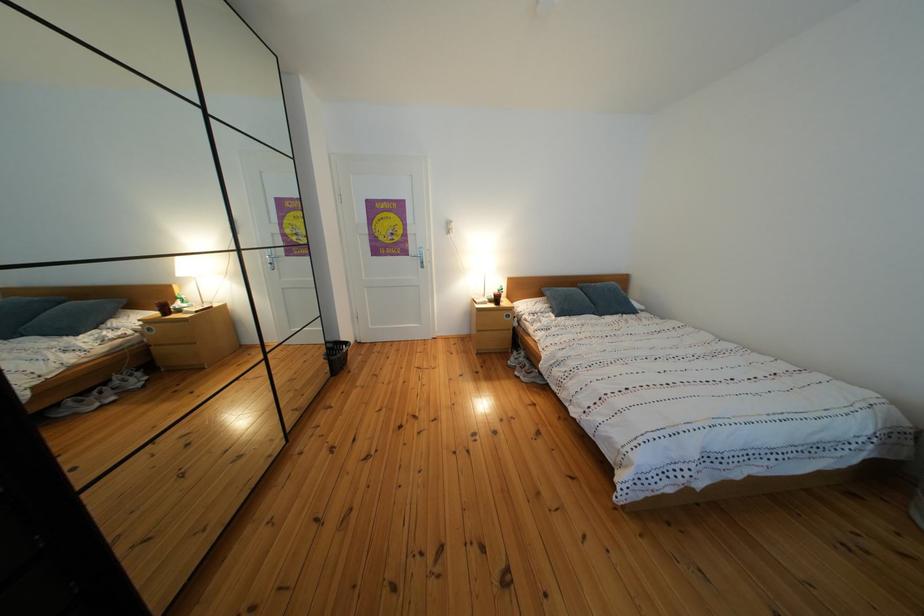
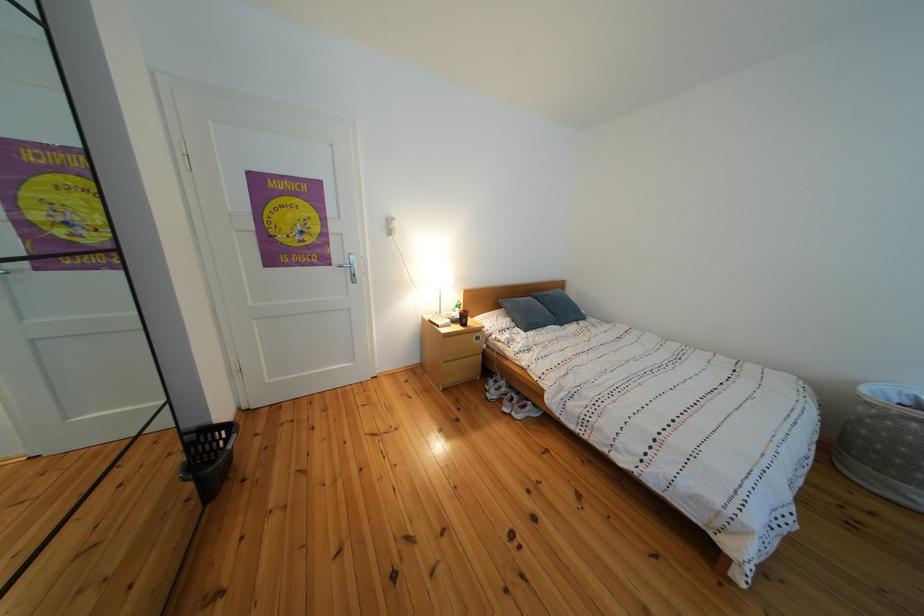
Find the pixel in the second image that matches (x=544, y=379) in the first image.

(540, 414)